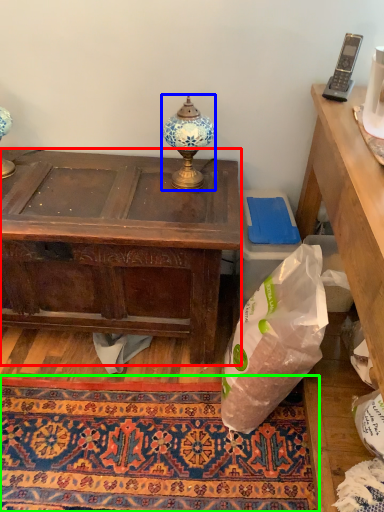
Question: Based on their relative distances, which object is nearer to desk (highlighted by a red box)? Choose from lamp (highlighted by a blue box) and mat (highlighted by a green box).

Choices:
 (A) lamp
 (B) mat

Answer: (A)